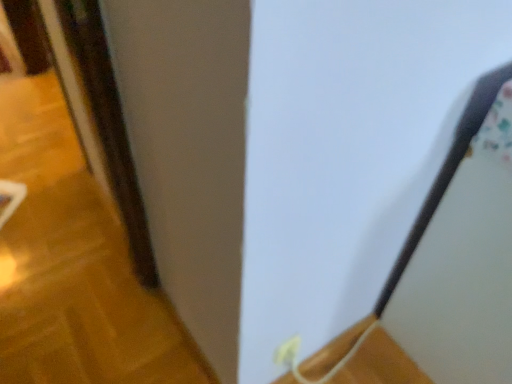
Question: Is white plastic electric outlet at lower center shorter than brown wooden door at left?

Choices:
 (A) yes
 (B) no

Answer: (B)

Question: Can you confirm if white plastic electric outlet at lower center is wider than brown wooden door at left?

Choices:
 (A) no
 (B) yes

Answer: (A)

Question: Is white plastic electric outlet at lower center positioned far away from brown wooden door at left?

Choices:
 (A) no
 (B) yes

Answer: (B)

Question: From the image's perspective, does white plastic electric outlet at lower center appear higher than brown wooden door at left?

Choices:
 (A) yes
 (B) no

Answer: (B)

Question: Are white plastic electric outlet at lower center and brown wooden door at left making contact?

Choices:
 (A) no
 (B) yes

Answer: (A)

Question: From a real-world perspective, is white plastic electric outlet at lower center located higher than brown wooden door at left?

Choices:
 (A) yes
 (B) no

Answer: (A)

Question: From the image's perspective, is wooden at lower right above brown wooden door at left?

Choices:
 (A) yes
 (B) no

Answer: (B)

Question: Considering the relative sizes of wooden at lower right and brown wooden door at left in the image provided, is wooden at lower right smaller than brown wooden door at left?

Choices:
 (A) yes
 (B) no

Answer: (A)

Question: Considering the relative positions of wooden at lower right and brown wooden door at left in the image provided, is wooden at lower right to the left of brown wooden door at left from the viewer's perspective?

Choices:
 (A) yes
 (B) no

Answer: (B)

Question: Does wooden at lower right touch brown wooden door at left?

Choices:
 (A) no
 (B) yes

Answer: (A)

Question: Is wooden at lower right positioned far away from brown wooden door at left?

Choices:
 (A) yes
 (B) no

Answer: (B)

Question: Does wooden at lower right have a lesser height compared to brown wooden door at left?

Choices:
 (A) yes
 (B) no

Answer: (A)

Question: Can you confirm if white plastic electric outlet at lower center is bigger than wooden at lower right?

Choices:
 (A) yes
 (B) no

Answer: (B)